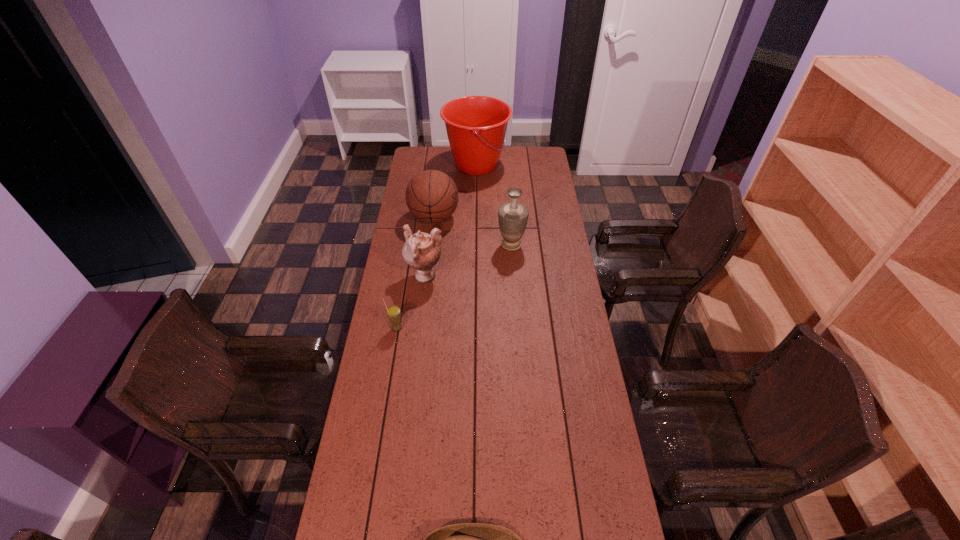
At what (x,y) coordinates should I click in order to perform the action: click on vacant space that satisfies the following two spatial constraints: 1. on the side with brand label of the fifth nearest object; 2. on the front side of the fifth tallest object. Please return your answer as a coordinate pair (x, y). This screenshot has height=540, width=960. Looking at the image, I should click on (421, 328).

Identify the location of free space that satisfies the following two spatial constraints: 1. with the handle attached to the rim of the bucket; 2. on the front side of the shorter urn. The height and width of the screenshot is (540, 960). (475, 277).

You are a GUI agent. You are given a task and a screenshot of the screen. Output one action in this format:
    pyautogui.click(x=<x>, y=<y>)
    Task: Click on the vacant position in the image that satisfies the following two spatial constraints: 1. with the handle attached to the rim of the farther urn; 2. on the right side of the farthest object
    
    Given the screenshot: What is the action you would take?
    pyautogui.click(x=476, y=245)

This screenshot has width=960, height=540. Find the location of `free spot that satisfies the following two spatial constraints: 1. with the handle attached to the rim of the farthest object; 2. on the right side of the fourth nearest object`. free spot that satisfies the following two spatial constraints: 1. with the handle attached to the rim of the farthest object; 2. on the right side of the fourth nearest object is located at coordinates (476, 245).

Locate an element on the screen. This screenshot has width=960, height=540. free point that satisfies the following two spatial constraints: 1. on the side with brand label of the basketball; 2. on the front side of the fifth tallest object is located at coordinates [x=421, y=328].

Where is `vacant position in the image that satisfies the following two spatial constraints: 1. on the side with brand label of the fourth nearest object; 2. on the right side of the second farthest object`? vacant position in the image that satisfies the following two spatial constraints: 1. on the side with brand label of the fourth nearest object; 2. on the right side of the second farthest object is located at coordinates (431, 245).

Image resolution: width=960 pixels, height=540 pixels. In order to click on blank area in the image that satisfies the following two spatial constraints: 1. with the handle attached to the rim of the farthest object; 2. on the front side of the fifth farthest object in this screenshot , I will do `click(475, 328)`.